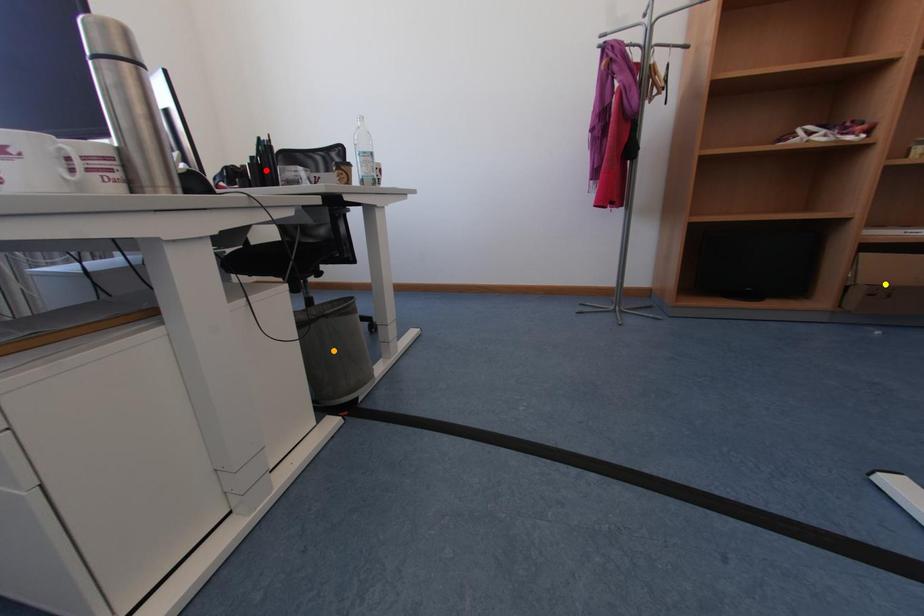
Order these from nearest to farthest:
- orange point
- red point
- yellow point

red point → yellow point → orange point